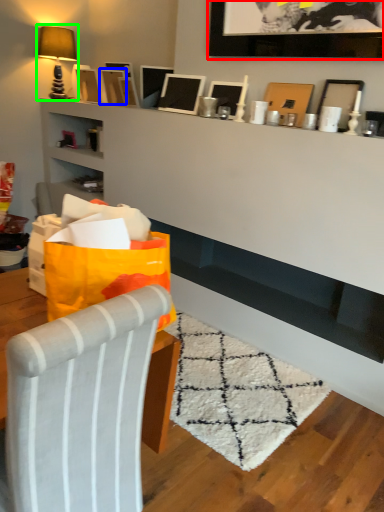
Question: Which is nearer to the picture frame (highlighted by a red box)? picture frame (highlighted by a blue box) or table lamp (highlighted by a green box).

Choices:
 (A) picture frame
 (B) table lamp

Answer: (A)